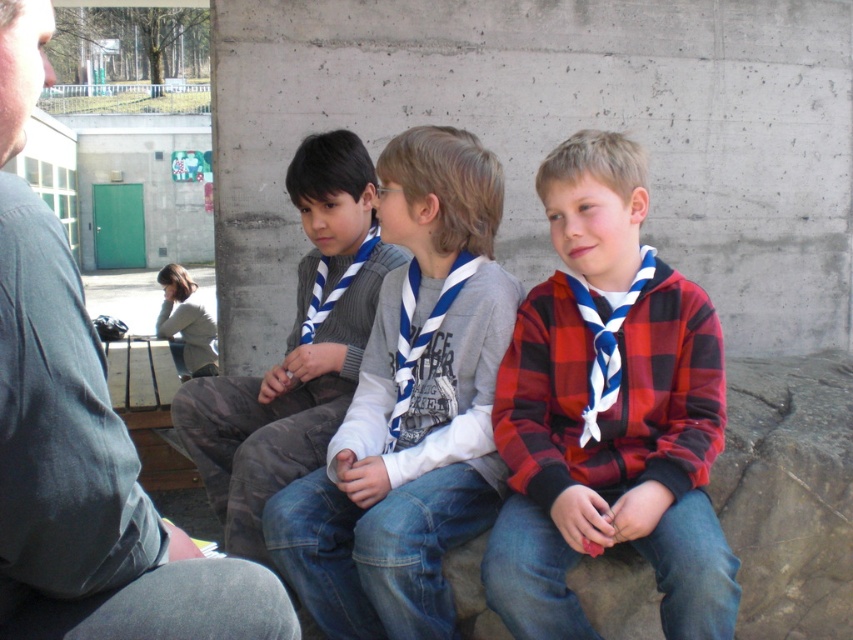
Question: Can you confirm if blue and white striped scarf at center is positioned above gray sweater vest at center?

Choices:
 (A) yes
 (B) no

Answer: (B)

Question: Is red plaid shirt at center above blue and white striped scarf at center?

Choices:
 (A) yes
 (B) no

Answer: (A)

Question: Which object is the farthest from the blue and white striped scarf at center?

Choices:
 (A) red plaid shirt at center
 (B) gray cotton shirt at left
 (C) gray sweater vest at center

Answer: (B)

Question: Is blue and white striped scarf at center to the left of gray sweater vest at center from the viewer's perspective?

Choices:
 (A) no
 (B) yes

Answer: (A)

Question: Which point is closer to the camera taking this photo?

Choices:
 (A) coord(605,492)
 (B) coord(68,468)
 (C) coord(375,300)
 (D) coord(428,566)

Answer: (B)

Question: Which point is closer to the camera?

Choices:
 (A) gray sweater vest at center
 (B) blue and white striped scarf at center
 (C) red plaid shirt at center

Answer: (C)